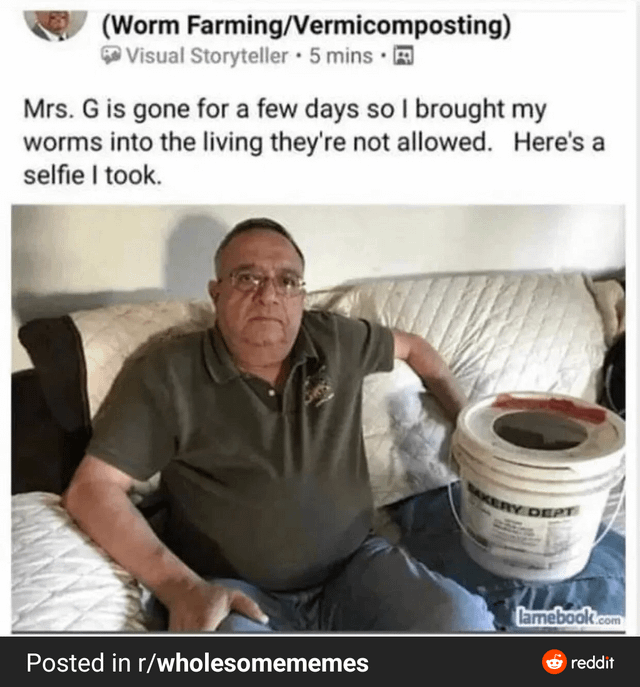
Identify the location of white couch cover. This screenshot has height=687, width=640. (x=502, y=321).